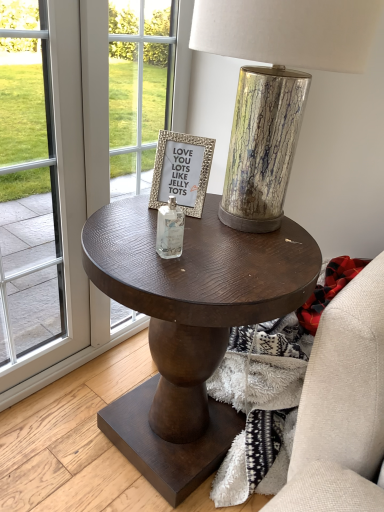
Question: Considering the relative positions of dark wood side table at center and gold textured frame at center in the image provided, is dark wood side table at center to the right of gold textured frame at center from the viewer's perspective?

Choices:
 (A) no
 (B) yes

Answer: (B)

Question: Is dark wood side table at center taller than gold textured frame at center?

Choices:
 (A) yes
 (B) no

Answer: (A)

Question: Is dark wood side table at center facing towards gold textured frame at center?

Choices:
 (A) yes
 (B) no

Answer: (B)

Question: From a real-world perspective, is dark wood side table at center physically above gold textured frame at center?

Choices:
 (A) yes
 (B) no

Answer: (B)

Question: Is dark wood side table at center behind gold textured frame at center?

Choices:
 (A) no
 (B) yes

Answer: (A)

Question: Is gold textured frame at center bigger or smaller than metallic cracked glass table lamp at center?

Choices:
 (A) small
 (B) big

Answer: (A)

Question: Considering their positions, is gold textured frame at center located in front of or behind metallic cracked glass table lamp at center?

Choices:
 (A) behind
 (B) front

Answer: (A)

Question: In the image, is gold textured frame at center on the left side or the right side of metallic cracked glass table lamp at center?

Choices:
 (A) left
 (B) right

Answer: (A)

Question: Is gold textured frame at center wider or thinner than metallic cracked glass table lamp at center?

Choices:
 (A) thin
 (B) wide

Answer: (A)

Question: Visually, is transparent glass screen door at left positioned to the left or to the right of gold textured frame at center?

Choices:
 (A) right
 (B) left

Answer: (B)

Question: Is transparent glass screen door at left in front of or behind gold textured frame at center in the image?

Choices:
 (A) behind
 (B) front

Answer: (B)

Question: From a real-world perspective, relative to gold textured frame at center, is transparent glass screen door at left vertically above or below?

Choices:
 (A) below
 (B) above

Answer: (A)

Question: Considering the positions of point (51, 121) and point (178, 189), is point (51, 121) closer or farther from the camera than point (178, 189)?

Choices:
 (A) closer
 (B) farther

Answer: (B)

Question: Is clear glass bottle at center wider or thinner than transparent glass screen door at left?

Choices:
 (A) thin
 (B) wide

Answer: (A)

Question: Considering the positions of clear glass bottle at center and transparent glass screen door at left in the image, is clear glass bottle at center bigger or smaller than transparent glass screen door at left?

Choices:
 (A) big
 (B) small

Answer: (B)